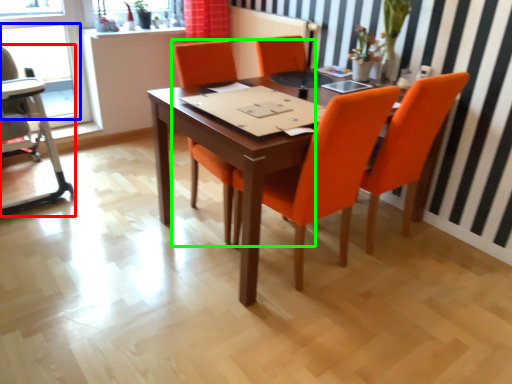
Question: Which object is positioned closest to armchair (highlighted by a red box)? Select from window (highlighted by a blue box) and chair (highlighted by a green box).

Choices:
 (A) window
 (B) chair

Answer: (A)